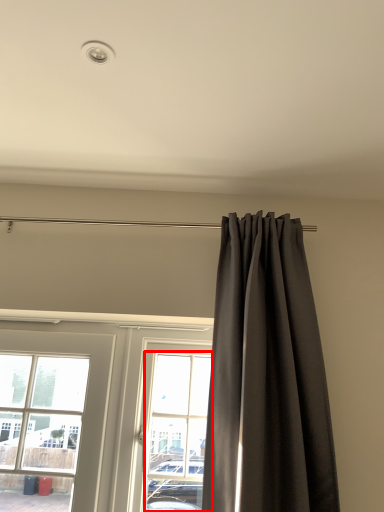
Question: From the image's perspective, where is bay window (annotated by the red box) located relative to curtain?

Choices:
 (A) below
 (B) above

Answer: (A)